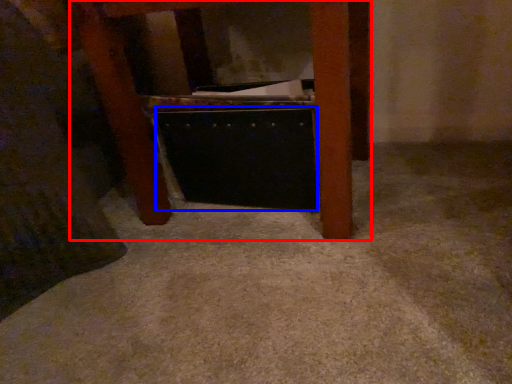
Question: Among these objects, which one is nearest to the camera, furniture (highlighted by a red box) or drawer (highlighted by a blue box)?

Choices:
 (A) furniture
 (B) drawer

Answer: (A)